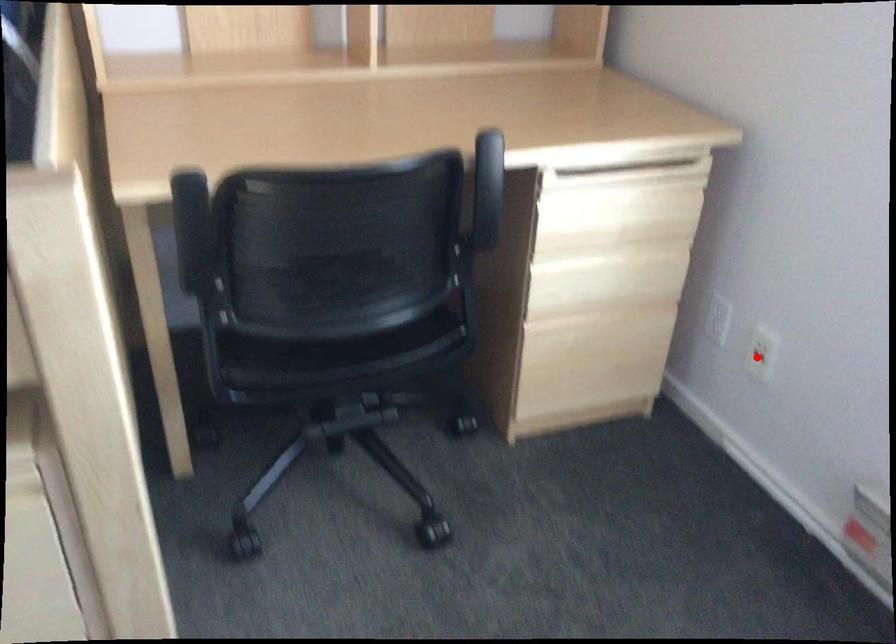
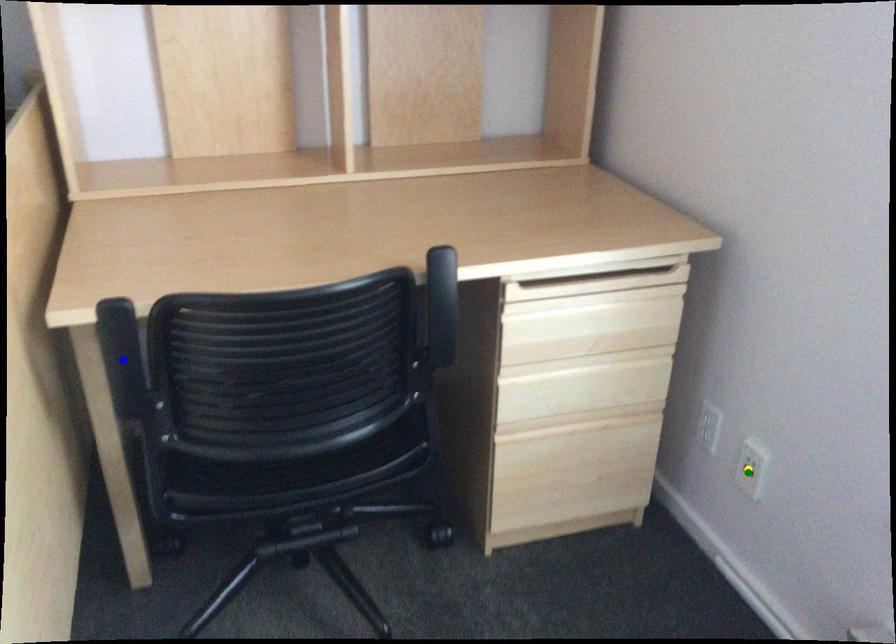
Question: I am providing you with two images of the same scene from different viewpoints. A red point is marked on the first image. You are given multiple points on the second image. Which point in image 2 is actually the same real-world point as the red point in image 1?

Choices:
 (A) yellow point
 (B) blue point
 (C) green point

Answer: (C)